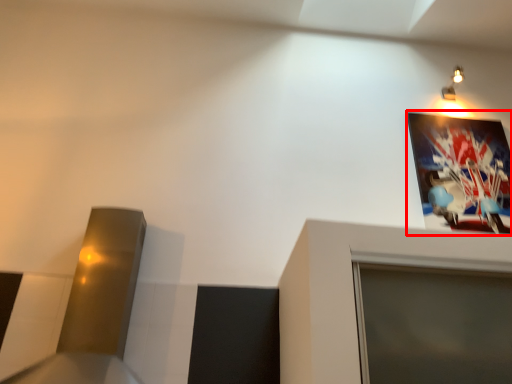
Question: Considering the relative positions of picture frame (annotated by the red box) and light fixture in the image provided, where is picture frame (annotated by the red box) located with respect to the staircase?

Choices:
 (A) left
 (B) right

Answer: (A)